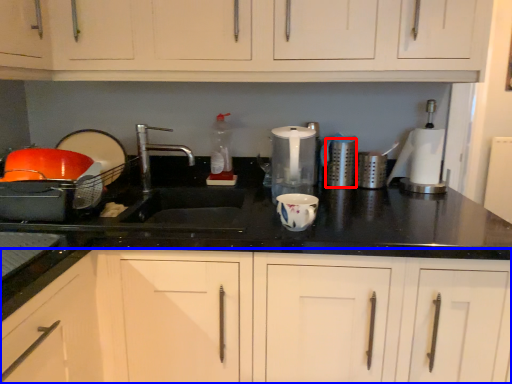
Question: Which point is closer to the camera, appliance (highlighted by a red box) or cabinetry (highlighted by a blue box)?

Choices:
 (A) appliance
 (B) cabinetry

Answer: (B)